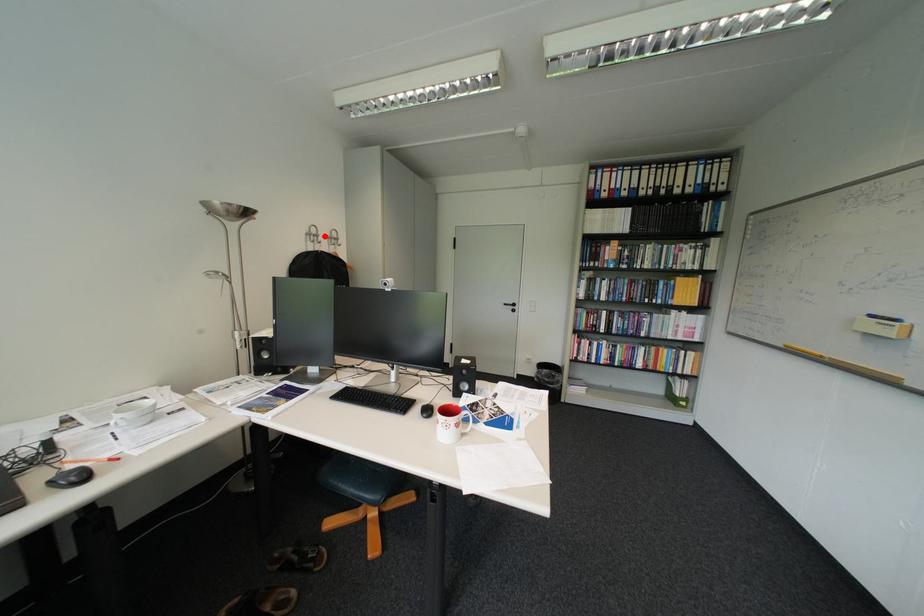
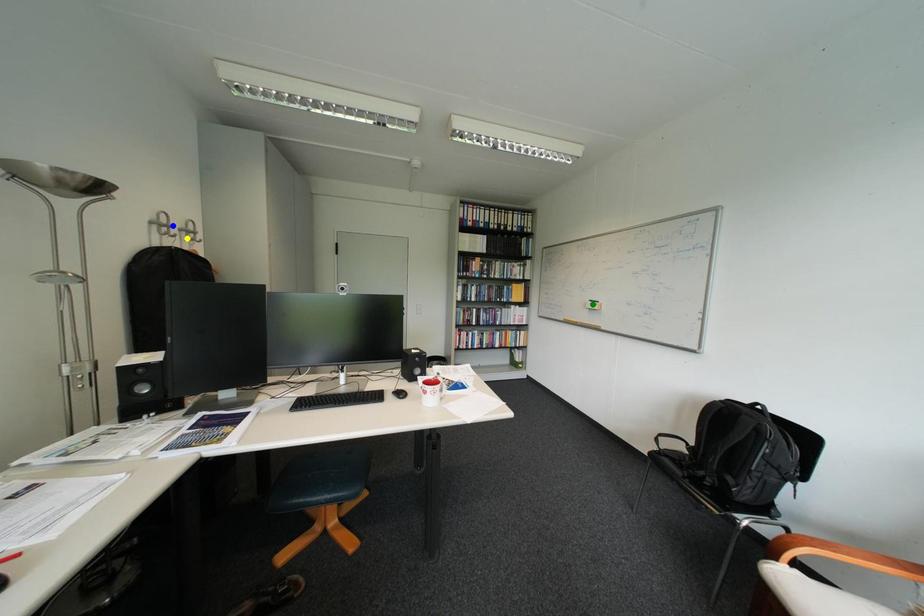
Question: I am providing you with two images of the same scene from different viewpoints. A red point is marked on the first image. You are given multiple points on the second image. Which spot in image 2 lines up with the point in image 1?

Choices:
 (A) yellow point
 (B) green point
 (C) blue point

Answer: (C)